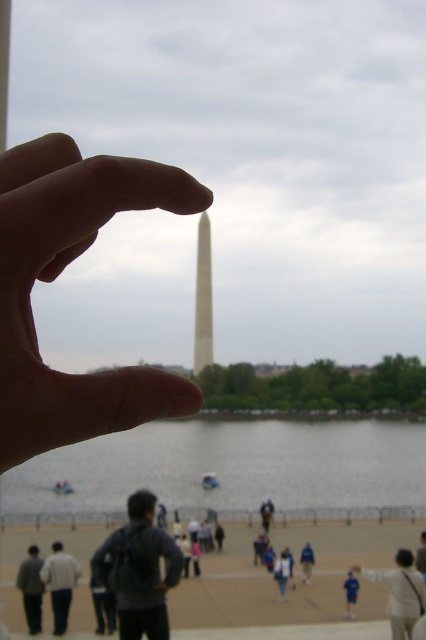
Question: Which point appears closest to the camera in this image?

Choices:
 (A) (20, 582)
 (B) (195, 330)
 (C) (135, 452)

Answer: (A)

Question: Which is nearer to the blue fabric jacket at lower center?

Choices:
 (A) light gray sweater at lower left
 (B) smooth skin hand at center

Answer: (A)

Question: Estimate the real-world distances between objects in this image. Which object is farther from the blue fabric jacket at lower center?

Choices:
 (A) dark gray backpack at center
 (B) light blue shirt at lower right

Answer: (A)

Question: Can you confirm if dark gray backpack at center is bigger than light blue shirt at lower right?

Choices:
 (A) no
 (B) yes

Answer: (B)

Question: Can you confirm if white marble obelisk at center is positioned above blue fabric person at lower right?

Choices:
 (A) yes
 (B) no

Answer: (A)

Question: Does clear water at lower center have a larger size compared to blue fabric person at lower right?

Choices:
 (A) no
 (B) yes

Answer: (B)